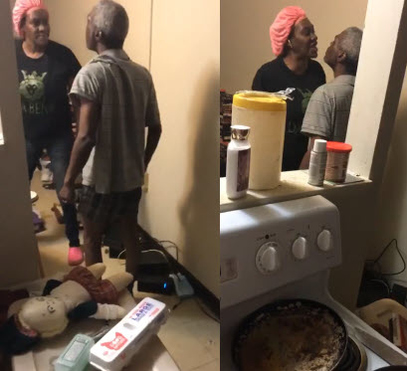
This screenshot has height=371, width=407. I want to click on bottle of lotion, so click(238, 135).